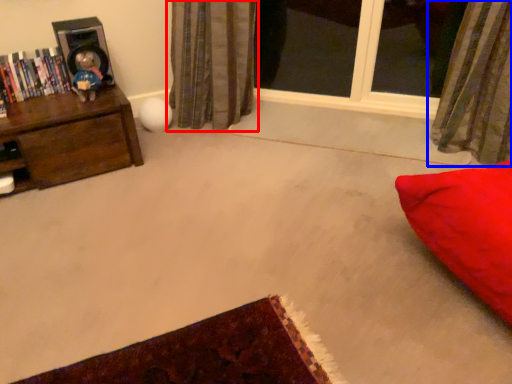
Question: Which object is closer to the camera taking this photo, curtain (highlighted by a red box) or curtain (highlighted by a blue box)?

Choices:
 (A) curtain
 (B) curtain

Answer: (B)